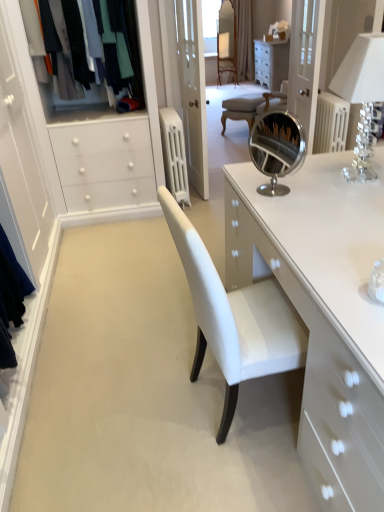
Question: Is clear crystal lampshade at upper right completely or partially outside of matte black clothes at left?

Choices:
 (A) yes
 (B) no

Answer: (A)

Question: Is clear crystal lampshade at upper right directly adjacent to matte black clothes at left?

Choices:
 (A) yes
 (B) no

Answer: (B)

Question: Does clear crystal lampshade at upper right have a larger size compared to matte black clothes at left?

Choices:
 (A) no
 (B) yes

Answer: (A)

Question: Does clear crystal lampshade at upper right turn towards matte black clothes at left?

Choices:
 (A) no
 (B) yes

Answer: (A)

Question: Can you confirm if clear crystal lampshade at upper right is positioned to the left of matte black clothes at left?

Choices:
 (A) yes
 (B) no

Answer: (B)

Question: Can you confirm if clear crystal lampshade at upper right is taller than matte black clothes at left?

Choices:
 (A) no
 (B) yes

Answer: (A)

Question: Could you tell me if clear crystal lampshade at upper right is facing clear glass door at upper center?

Choices:
 (A) yes
 (B) no

Answer: (B)

Question: From the image's perspective, is clear crystal lampshade at upper right located beneath clear glass door at upper center?

Choices:
 (A) yes
 (B) no

Answer: (A)

Question: Is clear crystal lampshade at upper right closer to camera compared to clear glass door at upper center?

Choices:
 (A) yes
 (B) no

Answer: (A)

Question: Is clear crystal lampshade at upper right bigger than clear glass door at upper center?

Choices:
 (A) no
 (B) yes

Answer: (A)

Question: Is clear crystal lampshade at upper right taller than clear glass door at upper center?

Choices:
 (A) yes
 (B) no

Answer: (B)

Question: Is clear crystal lampshade at upper right positioned beyond the bounds of clear glass door at upper center?

Choices:
 (A) no
 (B) yes

Answer: (B)

Question: From a real-world perspective, is white leather chair at center beneath clear glass door at upper center?

Choices:
 (A) yes
 (B) no

Answer: (A)